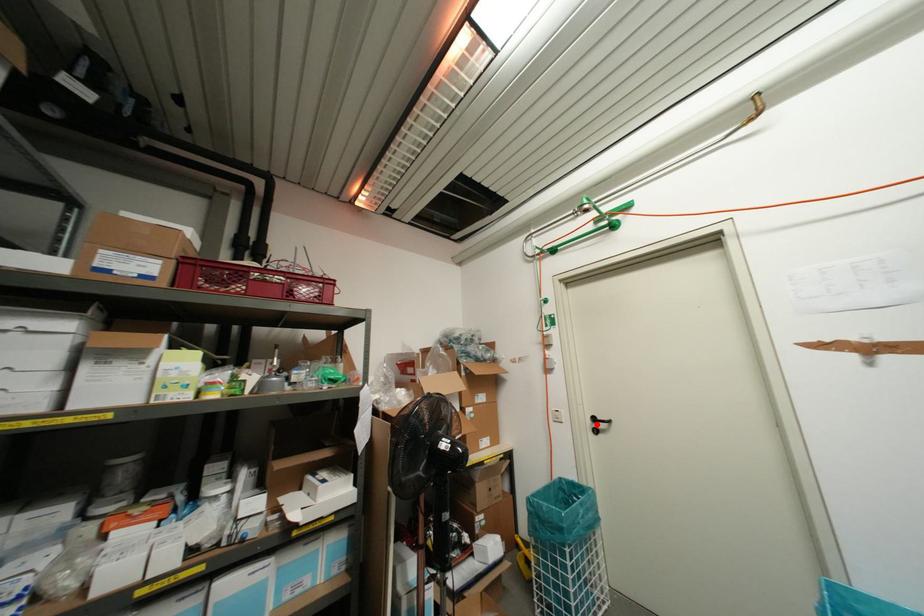
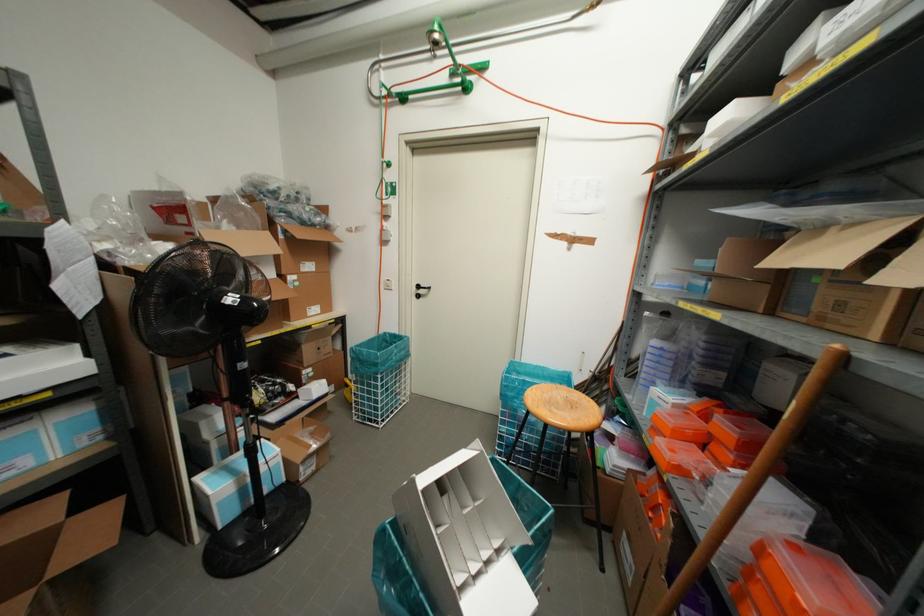
Question: I am providing you with two images of the same scene from different viewpoints. Given a red point in image1, look at the same physical point in image2. Is it:

Choices:
 (A) Closer to the viewpoint
 (B) Farther from the viewpoint

Answer: (A)